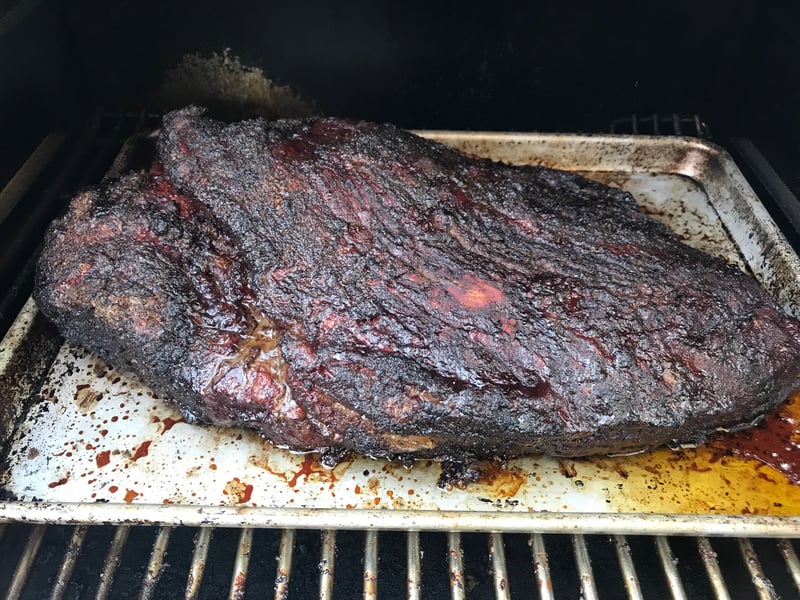
The width and height of the screenshot is (800, 600). Identify the location of grate. (453, 575).